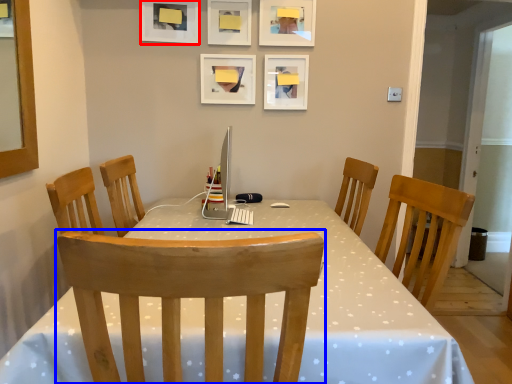
Question: Which object is further to the camera taking this photo, picture frame (highlighted by a red box) or chair (highlighted by a blue box)?

Choices:
 (A) picture frame
 (B) chair

Answer: (A)